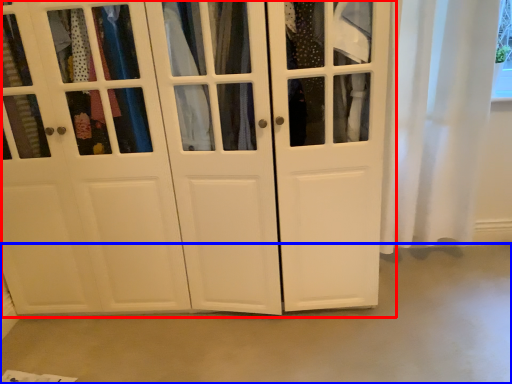
Question: Which object appears farthest to the camera in this image, cupboard (highlighted by a red box) or concrete (highlighted by a blue box)?

Choices:
 (A) cupboard
 (B) concrete

Answer: (B)